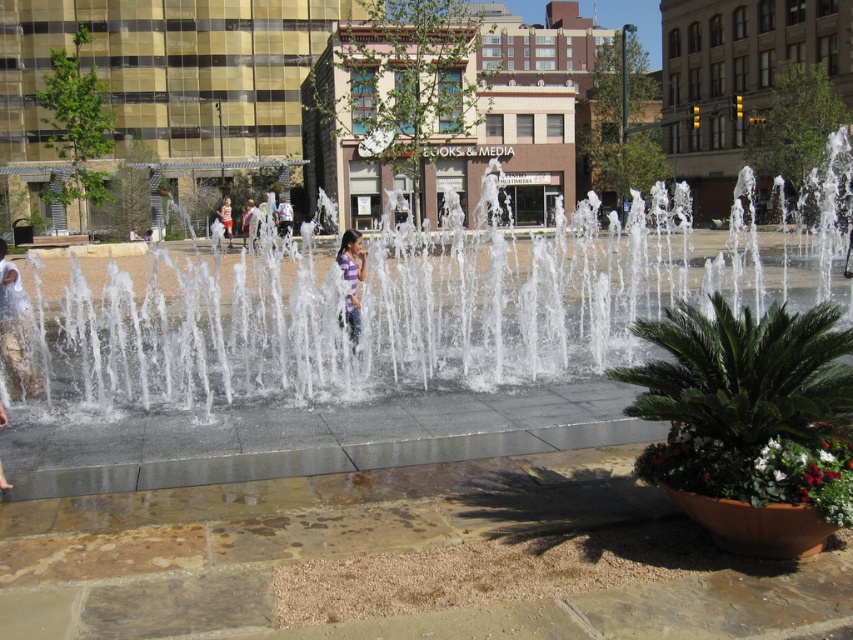
You are standing in the urban scene looking at the fountain. There are two points marked in the image. Which point, point (277,216) or point (222,220), is closer to you?

Point (277,216) is closer to you than point (222,220).

From the picture: You are a photographer trying to capture both the matte purple shirt at left and the purple striped shirt at center in a single shot. However, you notice that focusing on one makes the other blurry. Which shirt should you focus on to ensure the one closer to the camera is sharp?

You should focus on the matte purple shirt at left because it is in front of the purple striped shirt at center, making it closer to the camera.